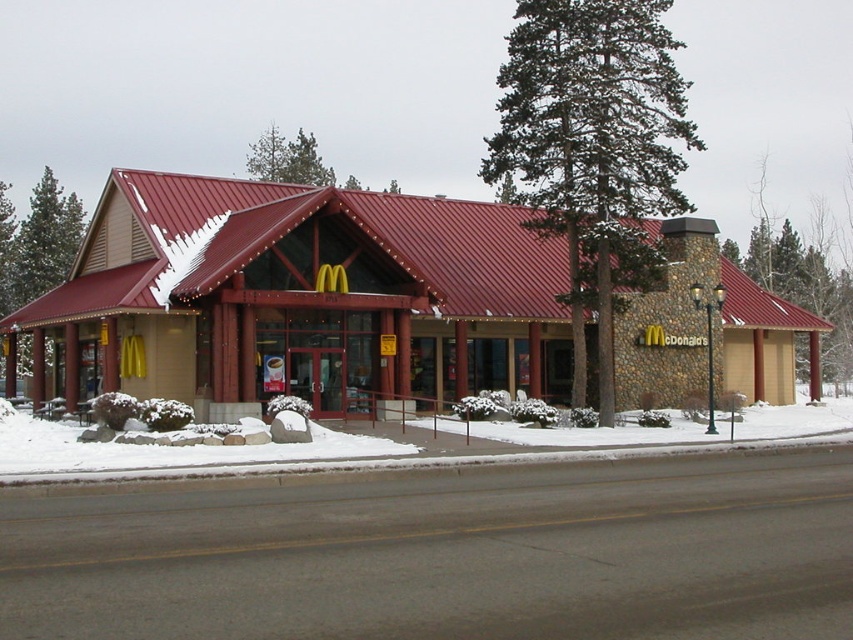
Between green coniferous tree at center and green textured tree at right, which one has less height?

green textured tree at right

What do you see at coordinates (593, 148) in the screenshot?
I see `green coniferous tree at center` at bounding box center [593, 148].

Describe the element at coordinates (593, 148) in the screenshot. I see `green coniferous tree at center` at that location.

The height and width of the screenshot is (640, 853). What are the coordinates of `green coniferous tree at center` in the screenshot? It's located at (593, 148).

Can you confirm if green coniferous tree at center is smaller than green leafy tree at left?

Incorrect, green coniferous tree at center is not smaller in size than green leafy tree at left.

Describe the element at coordinates (593, 148) in the screenshot. This screenshot has height=640, width=853. I see `green coniferous tree at center` at that location.

This screenshot has width=853, height=640. Identify the location of green coniferous tree at center. (593, 148).

Which is below, green textured tree at right or green leafy tree at left?

green textured tree at right

Is green textured tree at right closer to camera compared to green leafy tree at left?

That is True.

This screenshot has width=853, height=640. In order to click on green textured tree at right in this screenshot , I will do `click(804, 272)`.